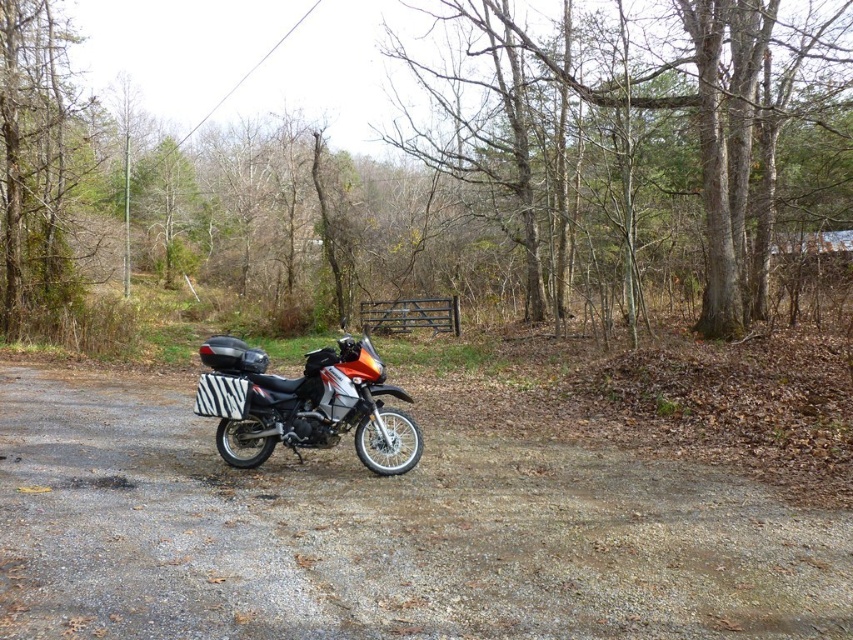
Looking at this image, does dirt/gravel road at center appear over zebra-patterned hard case at center?

No.

Who is higher up, dirt/gravel road at center or zebra-patterned hard case at center?

zebra-patterned hard case at center is above.

Is point (293, 620) in front of point (389, 422)?

Yes, it is in front of point (389, 422).

Locate an element on the screen. The height and width of the screenshot is (640, 853). dirt/gravel road at center is located at coordinates point(381,534).

Which of these two, zebra-patterned hard case at center or brown wooden gate at center, stands taller?

With more height is zebra-patterned hard case at center.

Does zebra-patterned hard case at center have a greater width compared to brown wooden gate at center?

No.

Who is more distant from viewer, (396, 387) or (432, 317)?

Positioned behind is point (432, 317).

At what (x,y) coordinates should I click in order to perform the action: click on zebra-patterned hard case at center. Please return your answer as a coordinate pair (x, y). Image resolution: width=853 pixels, height=640 pixels. Looking at the image, I should click on (302, 403).

Does smooth bark tree at center appear on the right side of zebra-patterned hard case at center?

Correct, you'll find smooth bark tree at center to the right of zebra-patterned hard case at center.

Who is more forward, (821,36) or (200,355)?

Positioned in front is point (821,36).

Locate an element on the screen. This screenshot has height=640, width=853. smooth bark tree at center is located at coordinates (630, 109).